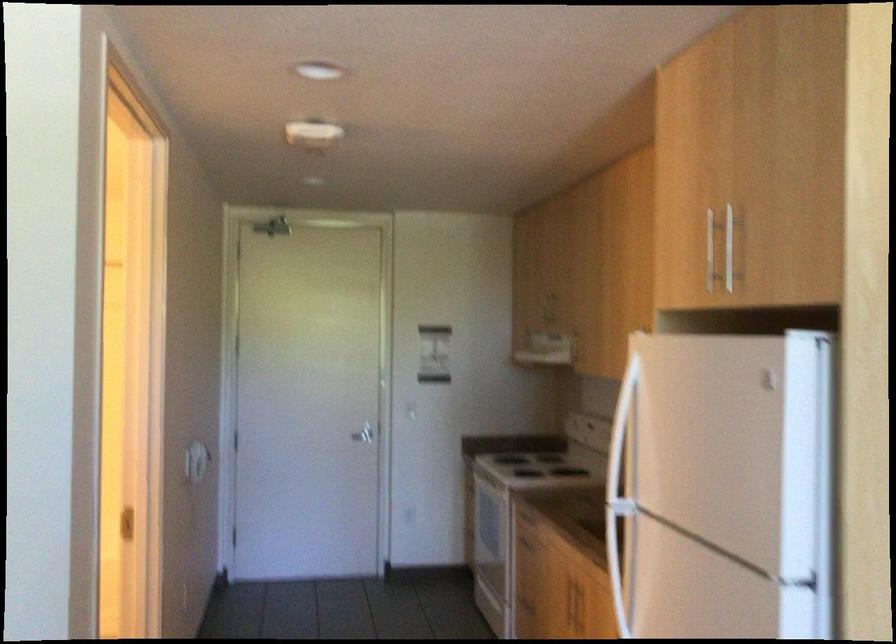
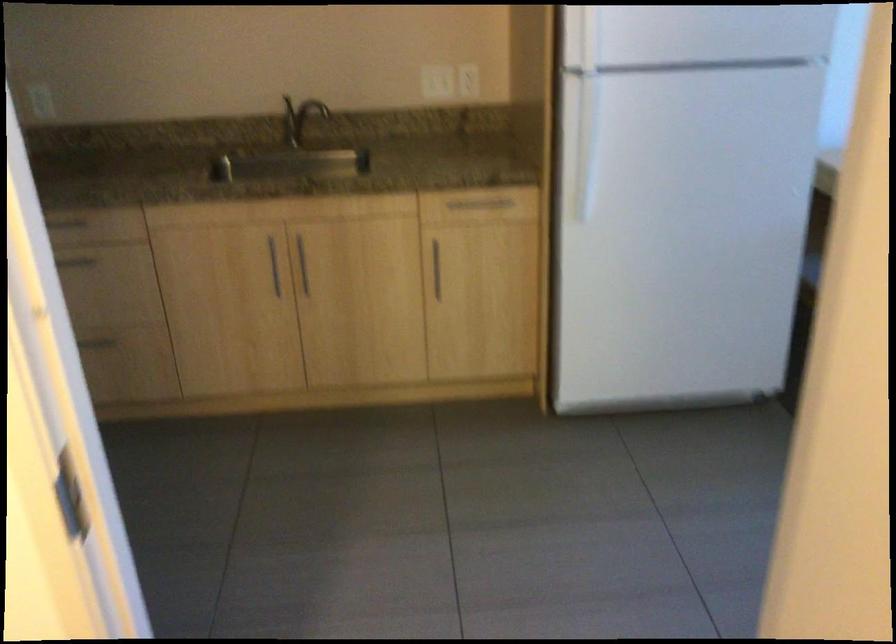
Where in the second image is the point corresponding to (648,562) from the first image?

(586, 146)